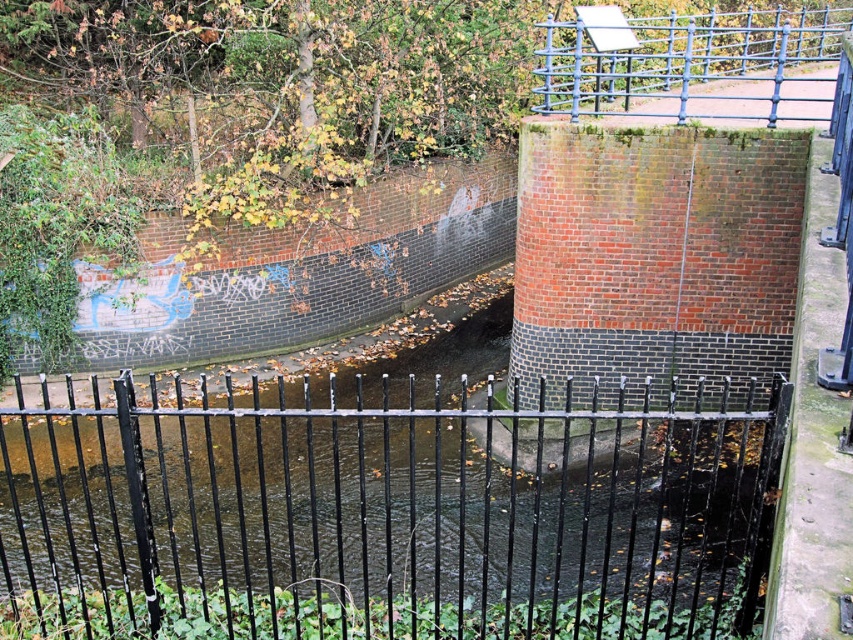
Question: Where is black wrought iron fence at center located in relation to blue metal fence at upper right in the image?

Choices:
 (A) above
 (B) below

Answer: (B)

Question: Is black wrought iron fence at center bigger than blue metal fence at upper right?

Choices:
 (A) yes
 (B) no

Answer: (B)

Question: Among these objects, which one is farthest from the camera?

Choices:
 (A) blue metal fence at upper right
 (B) black wrought iron fence at center

Answer: (A)

Question: Is black wrought iron fence at center smaller than blue metal fence at upper right?

Choices:
 (A) yes
 (B) no

Answer: (A)